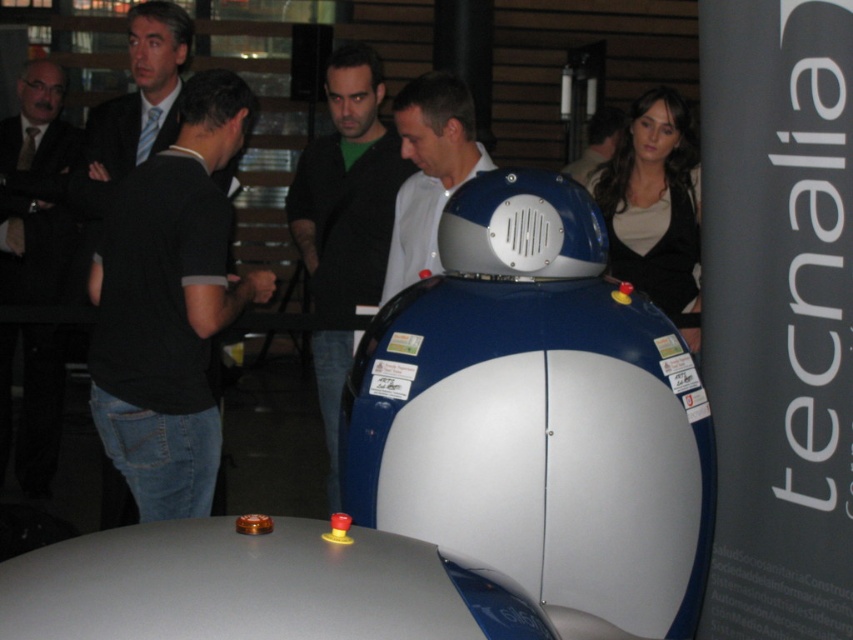
Question: Based on their relative distances, which object is nearer to the dark blue shirt at upper center?

Choices:
 (A) dark green shirt at center
 (B) dark suit at left
 (C) white matte shirt at center

Answer: (A)

Question: Which object appears farthest from the camera in this image?

Choices:
 (A) dark blue shirt at upper center
 (B) dark green shirt at center
 (C) black cotton shirt at left

Answer: (A)

Question: Can you confirm if black cotton shirt at left is positioned above dark green shirt at center?

Choices:
 (A) no
 (B) yes

Answer: (A)

Question: Can you confirm if white matte shirt at center is positioned to the right of dark blue shirt at upper center?

Choices:
 (A) yes
 (B) no

Answer: (B)

Question: Is dark suit at left below white matte shirt at center?

Choices:
 (A) no
 (B) yes

Answer: (B)

Question: Which object is the closest to the white matte shirt at center?

Choices:
 (A) dark blue shirt at upper center
 (B) black cotton shirt at left
 (C) dark suit at left
 (D) dark green shirt at center

Answer: (D)